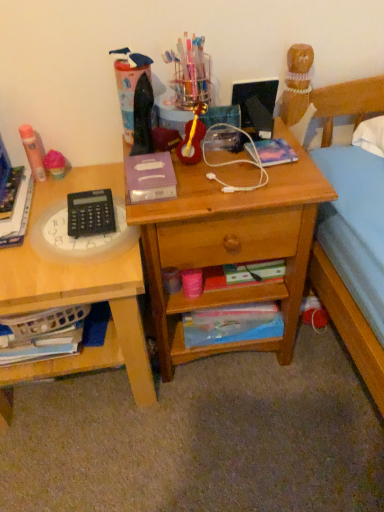
You are a GUI agent. You are given a task and a screenshot of the screen. Output one action in this format:
    pyautogui.click(x=<x>, y=<y>)
    Task: Click on the free space to the left of white matte earphones at center
    This screenshot has width=384, height=512.
    Given the screenshot: What is the action you would take?
    pyautogui.click(x=179, y=185)